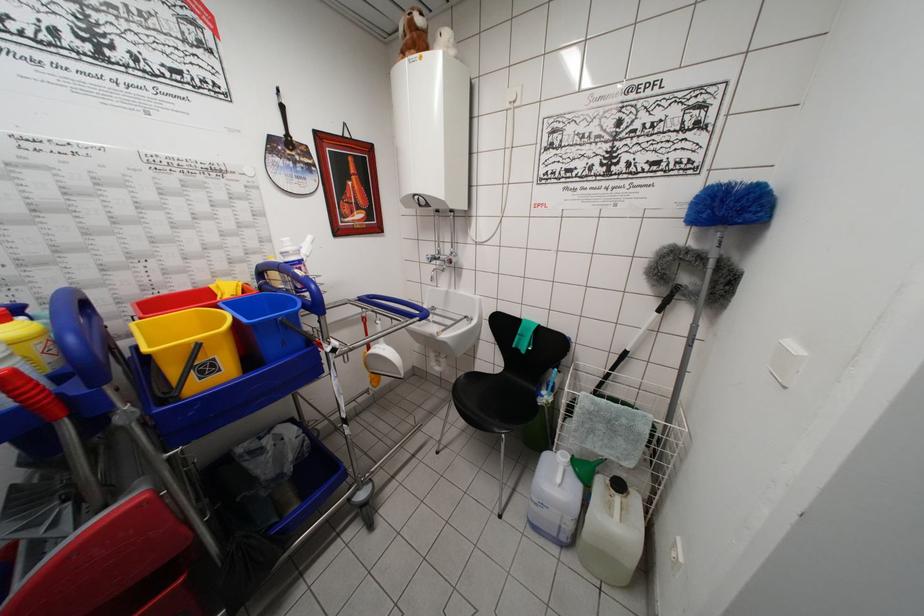
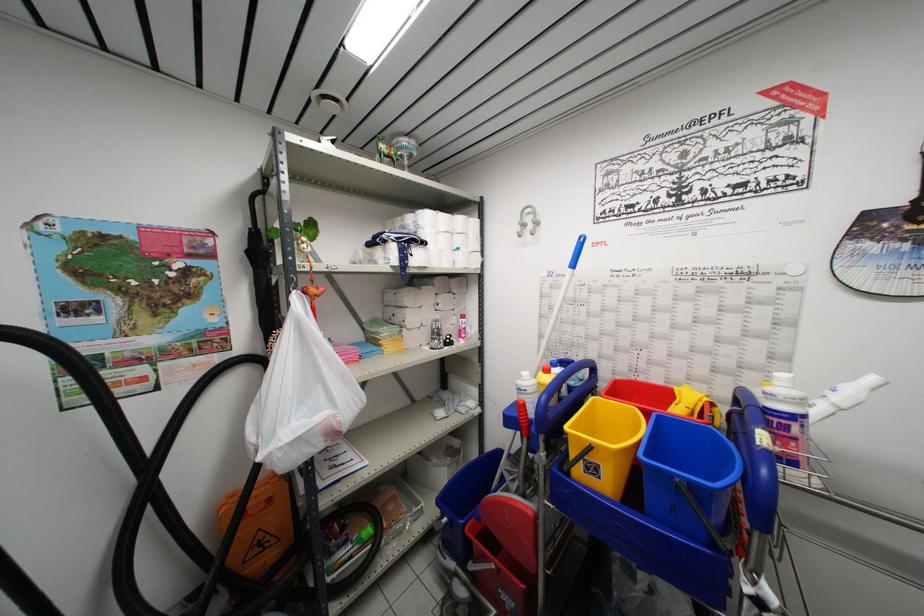
Where in the second image is the point corresponding to (203,384) from the first image?

(589, 477)